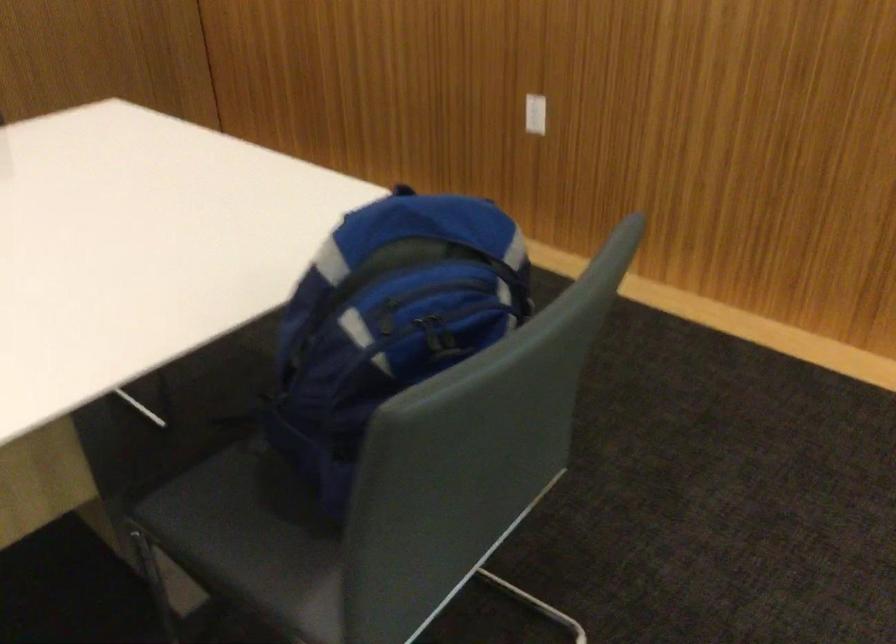
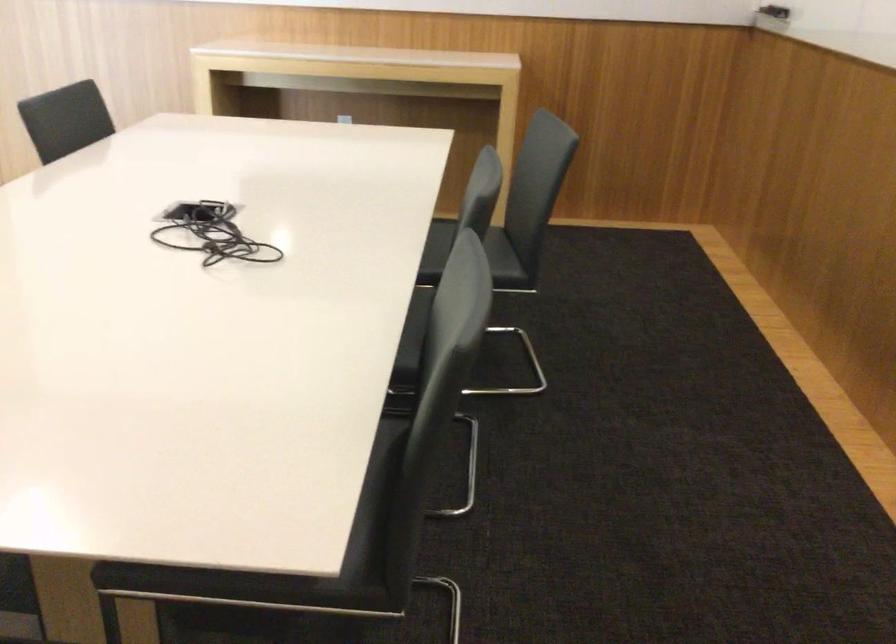
The point at (99, 109) is marked in the first image. Where is the corresponding point in the second image?

(311, 558)